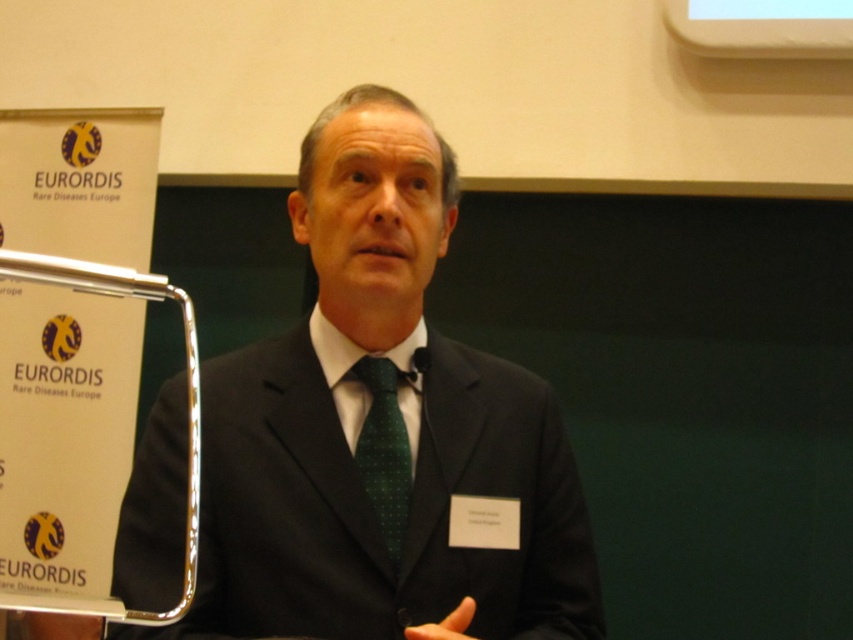
Question: Which object appears farthest from the camera in this image?

Choices:
 (A) black matte suit at center
 (B) green dotted fabric tie at center

Answer: (B)

Question: Can you confirm if black matte suit at center is thinner than green dotted fabric tie at center?

Choices:
 (A) no
 (B) yes

Answer: (A)

Question: Which of the following is the farthest from the observer?

Choices:
 (A) (375, 488)
 (B) (312, 406)

Answer: (B)

Question: Which point is farther to the camera?

Choices:
 (A) black matte suit at center
 (B) green dotted fabric tie at center

Answer: (B)

Question: Can you confirm if black matte suit at center is positioned to the right of green dotted fabric tie at center?

Choices:
 (A) yes
 (B) no

Answer: (B)

Question: Does black matte suit at center appear on the right side of green dotted fabric tie at center?

Choices:
 (A) no
 (B) yes

Answer: (A)